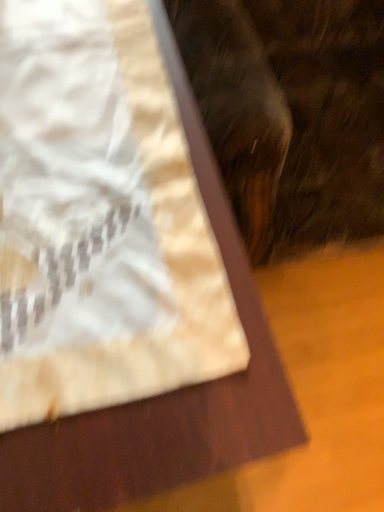
Question: From the image's perspective, relative to fuzzy brown cat at upper right, is white paper bag at center above or below?

Choices:
 (A) below
 (B) above

Answer: (A)

Question: In the image, is white paper bag at center positioned in front of or behind fuzzy brown cat at upper right?

Choices:
 (A) front
 (B) behind

Answer: (B)

Question: Would you say white paper bag at center is inside or outside fuzzy brown cat at upper right?

Choices:
 (A) inside
 (B) outside

Answer: (B)

Question: From a real-world perspective, relative to white paper bag at center, is fuzzy brown cat at upper right vertically above or below?

Choices:
 (A) above
 (B) below

Answer: (A)

Question: Considering the positions of point (228, 67) and point (145, 225), is point (228, 67) closer or farther from the camera than point (145, 225)?

Choices:
 (A) farther
 (B) closer

Answer: (A)

Question: From their relative heights in the image, would you say fuzzy brown cat at upper right is taller or shorter than white paper bag at center?

Choices:
 (A) tall
 (B) short

Answer: (A)

Question: Is fuzzy brown cat at upper right to the left or to the right of white paper bag at center in the image?

Choices:
 (A) left
 (B) right

Answer: (B)